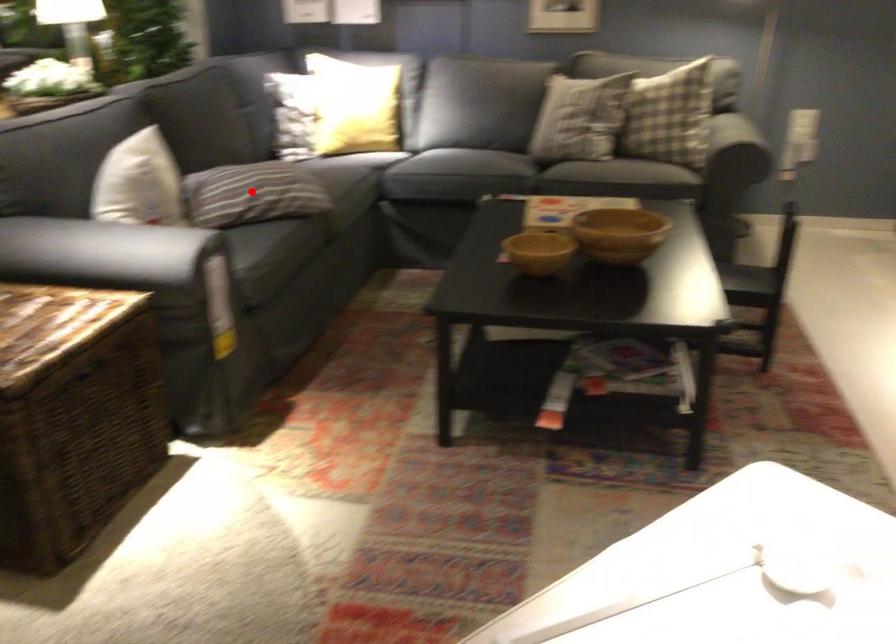
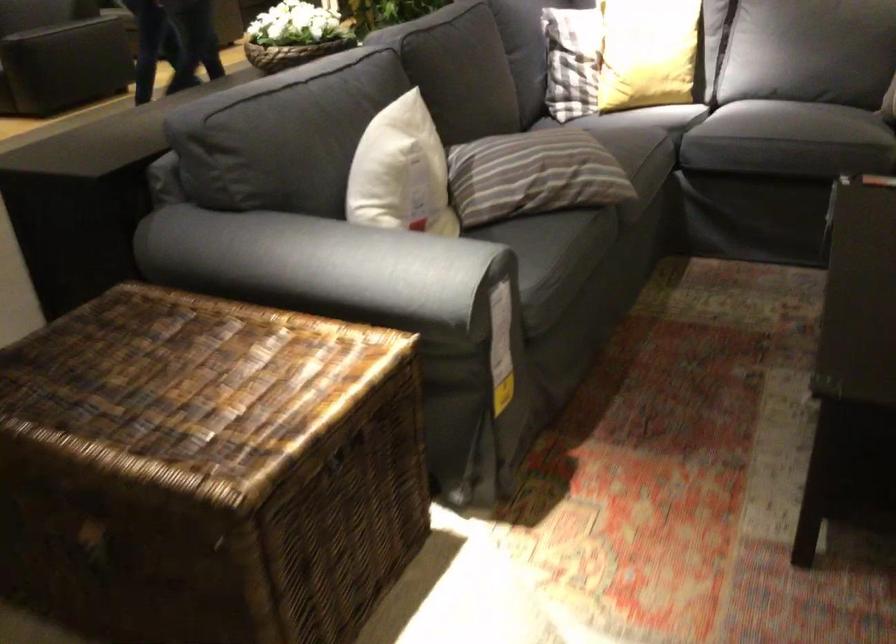
Question: I am providing you with two images of the same scene from different viewpoints. A red point is marked on the first image. Can you still see the location of the red point in image 2?

Choices:
 (A) Yes
 (B) No

Answer: (A)